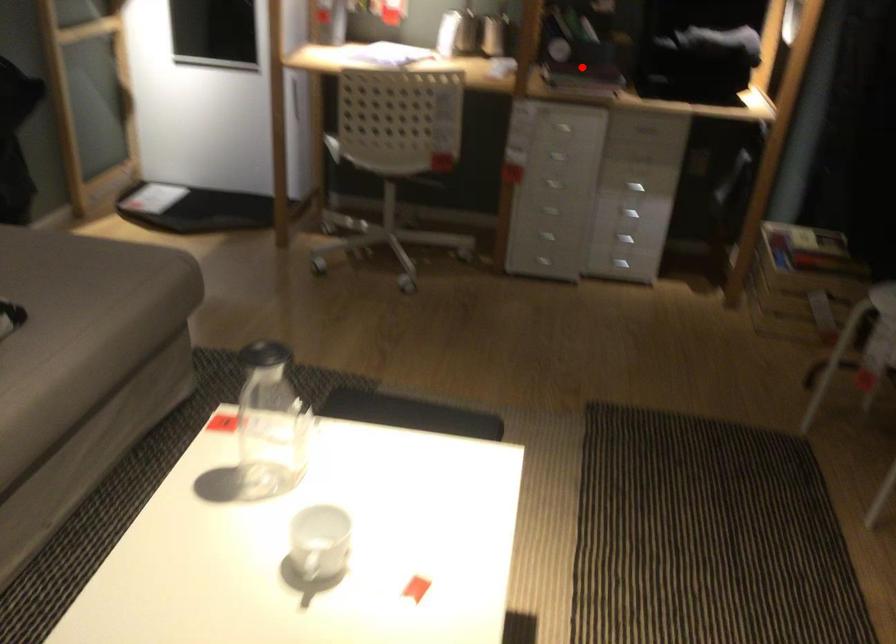
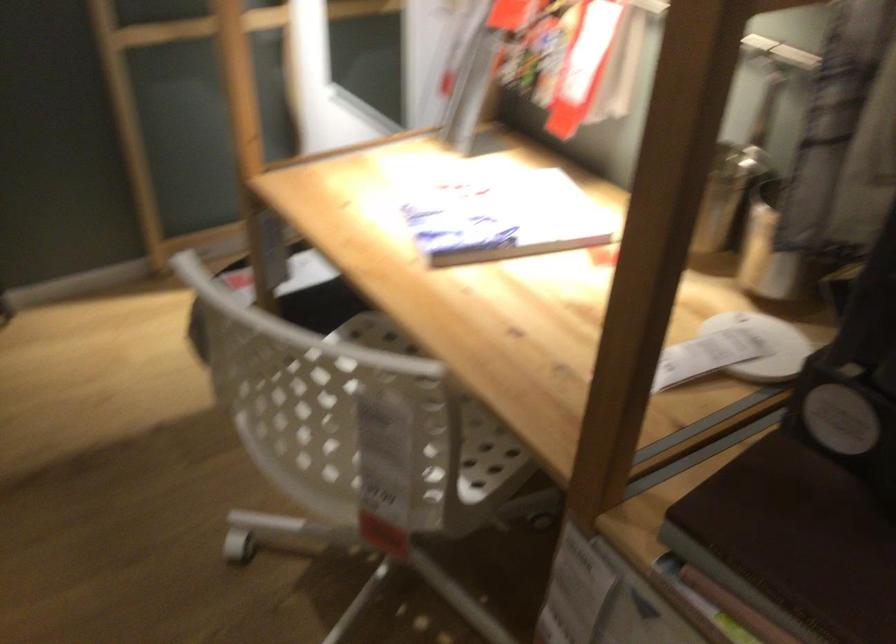
Where in the second image is the point corresponding to the highlighted location from the first image?

(793, 542)